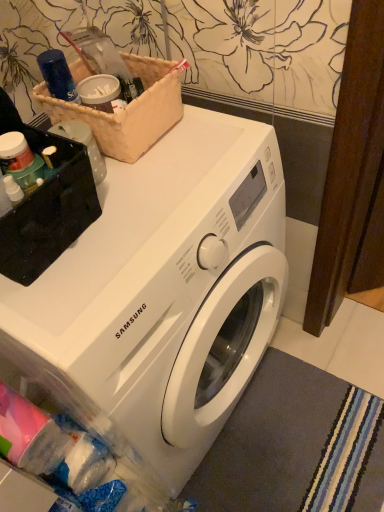
Where is `brown woven basket at upper left`? brown woven basket at upper left is located at coordinates (127, 110).

This screenshot has height=512, width=384. Describe the element at coordinates (278, 440) in the screenshot. I see `gray soft carpet at lower right` at that location.

Find the location of a particular element. This screenshot has height=512, width=384. brown woven basket at upper left is located at coordinates [127, 110].

Identify the location of basket in front of the gray soft carpet at lower right. This screenshot has height=512, width=384. (127, 110).

Considering the points (365, 481) and (164, 118), which point is behind, point (365, 481) or point (164, 118)?

Positioned behind is point (365, 481).

From the image's perspective, who appears lower, gray soft carpet at lower right or brown woven basket at upper left?

gray soft carpet at lower right is shown below in the image.

Who is more distant, gray soft carpet at lower right or brown woven basket at upper left?

gray soft carpet at lower right is behind.

Which point is more distant from viewer, [20,339] or [151,90]?

Positioned behind is point [151,90].

From the image's perspective, is white glossy washing machine at center beneath brown woven basket at upper left?

Indeed, from the image's perspective, white glossy washing machine at center is shown beneath brown woven basket at upper left.

Which object is positioned more to the right, white glossy washing machine at center or brown woven basket at upper left?

white glossy washing machine at center is more to the right.

Is white glossy washing machine at center placed right next to gray soft carpet at lower right?

No, white glossy washing machine at center is not making contact with gray soft carpet at lower right.

Does white glossy washing machine at center have a larger size compared to gray soft carpet at lower right?

Correct, white glossy washing machine at center is larger in size than gray soft carpet at lower right.

Is white glossy washing machine at center aimed at gray soft carpet at lower right?

Yes, white glossy washing machine at center is facing gray soft carpet at lower right.

Does point (254, 122) come behind point (285, 488)?

That is False.

Does point (141, 110) lie in front of point (327, 429)?

Yes.

From the image's perspective, who appears lower, brown woven basket at upper left or gray soft carpet at lower right?

gray soft carpet at lower right.

Considering the positions of objects brown woven basket at upper left and gray soft carpet at lower right in the image provided, who is more to the right, brown woven basket at upper left or gray soft carpet at lower right?

Positioned to the right is gray soft carpet at lower right.

Looking at the image, does brown woven basket at upper left seem bigger or smaller compared to gray soft carpet at lower right?

brown woven basket at upper left is bigger than gray soft carpet at lower right.

Does brown woven basket at upper left have a smaller size compared to white glossy washing machine at center?

Correct, brown woven basket at upper left occupies less space than white glossy washing machine at center.

Consider the image. From the image's perspective, between brown woven basket at upper left and white glossy washing machine at center, who is located below?

white glossy washing machine at center.

Are brown woven basket at upper left and white glossy washing machine at center making contact?

brown woven basket at upper left and white glossy washing machine at center are clearly separated.

Considering the relative sizes of brown woven basket at upper left and white glossy washing machine at center in the image provided, is brown woven basket at upper left taller than white glossy washing machine at center?

No.

From a real-world perspective, is gray soft carpet at lower right positioned above or below white glossy washing machine at center?

Clearly, from a real-world perspective, gray soft carpet at lower right is below white glossy washing machine at center.

Is gray soft carpet at lower right oriented towards white glossy washing machine at center?

No, gray soft carpet at lower right is not facing towards white glossy washing machine at center.

The image size is (384, 512). Find the location of `bath mat to the right of white glossy washing machine at center`. bath mat to the right of white glossy washing machine at center is located at coordinates (278, 440).

Is gray soft carpet at lower right inside or outside of white glossy washing machine at center?

gray soft carpet at lower right is not enclosed by white glossy washing machine at center.

The height and width of the screenshot is (512, 384). What are the coordinates of `basket in front of the gray soft carpet at lower right` in the screenshot? It's located at (127, 110).

This screenshot has height=512, width=384. What are the coordinates of `basket behind the white glossy washing machine at center` in the screenshot? It's located at (127, 110).

Which object lies nearer to the anchor point gray soft carpet at lower right, brown woven basket at upper left or white glossy washing machine at center?

white glossy washing machine at center is closer to gray soft carpet at lower right.

Which object lies further to the anchor point white glossy washing machine at center, brown woven basket at upper left or gray soft carpet at lower right?

gray soft carpet at lower right.

When comparing their distances from brown woven basket at upper left, does white glossy washing machine at center or gray soft carpet at lower right seem further?

gray soft carpet at lower right is further to brown woven basket at upper left.

Looking at the image, which one is located closer to brown woven basket at upper left, gray soft carpet at lower right or white glossy washing machine at center?

white glossy washing machine at center is closer to brown woven basket at upper left.

Based on their spatial positions, is white glossy washing machine at center or brown woven basket at upper left further from gray soft carpet at lower right?

Among the two, brown woven basket at upper left is located further to gray soft carpet at lower right.

Which object lies further to the anchor point white glossy washing machine at center, gray soft carpet at lower right or brown woven basket at upper left?

gray soft carpet at lower right is further to white glossy washing machine at center.

Where is `washing machine between brown woven basket at upper left and gray soft carpet at lower right in the vertical direction`? The image size is (384, 512). washing machine between brown woven basket at upper left and gray soft carpet at lower right in the vertical direction is located at coordinates (163, 295).